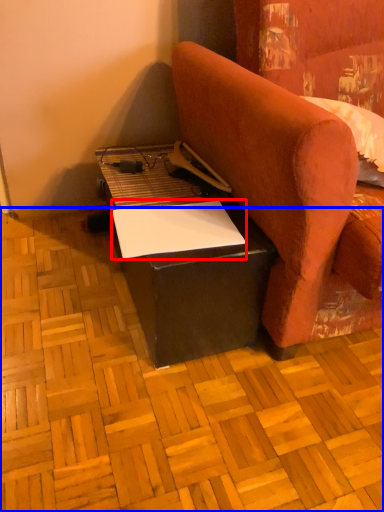
Question: Among these objects, which one is nearest to the camera, notepad (highlighted by a red box) or plywood (highlighted by a blue box)?

Choices:
 (A) notepad
 (B) plywood

Answer: (B)